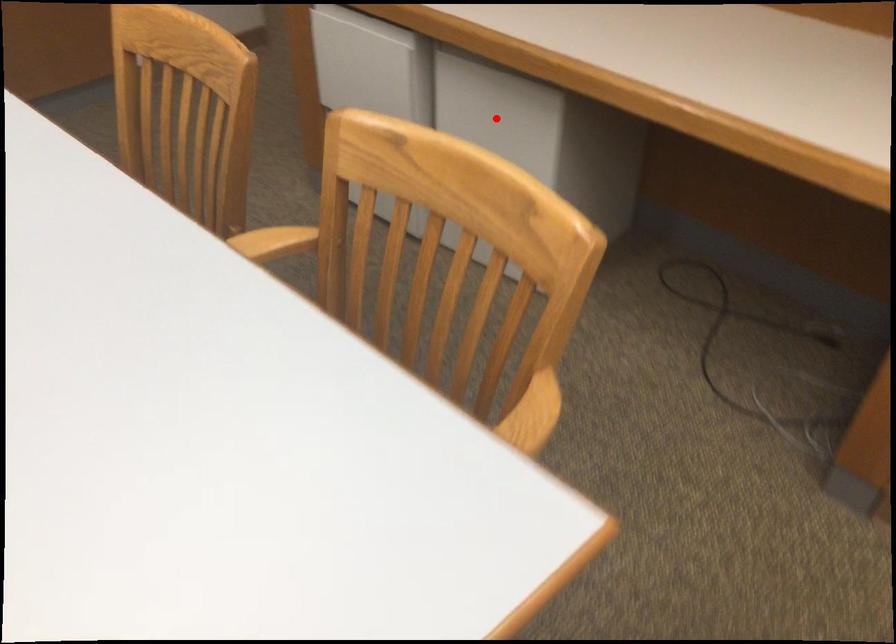
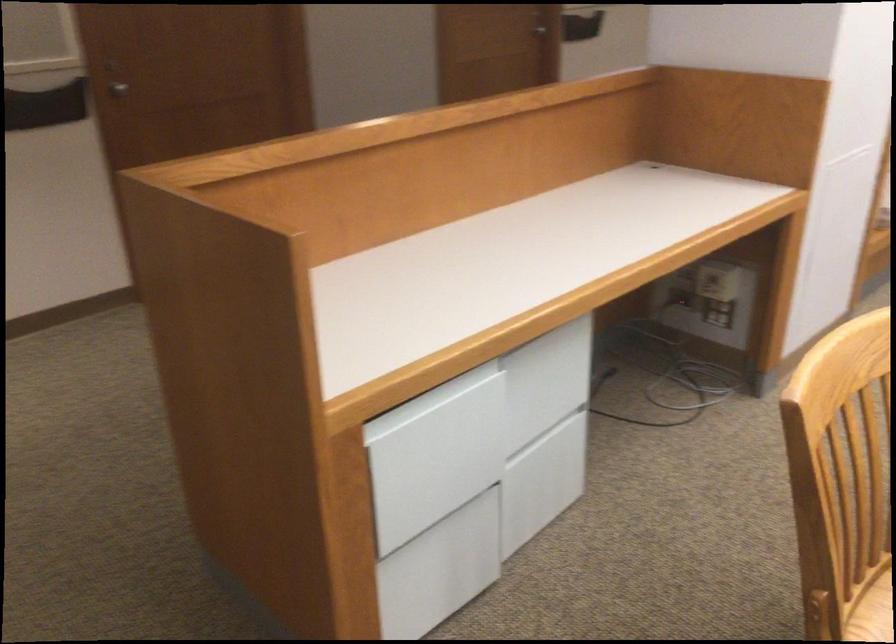
In the second image, find the point that corresponds to the highlighted location in the first image.

(547, 381)